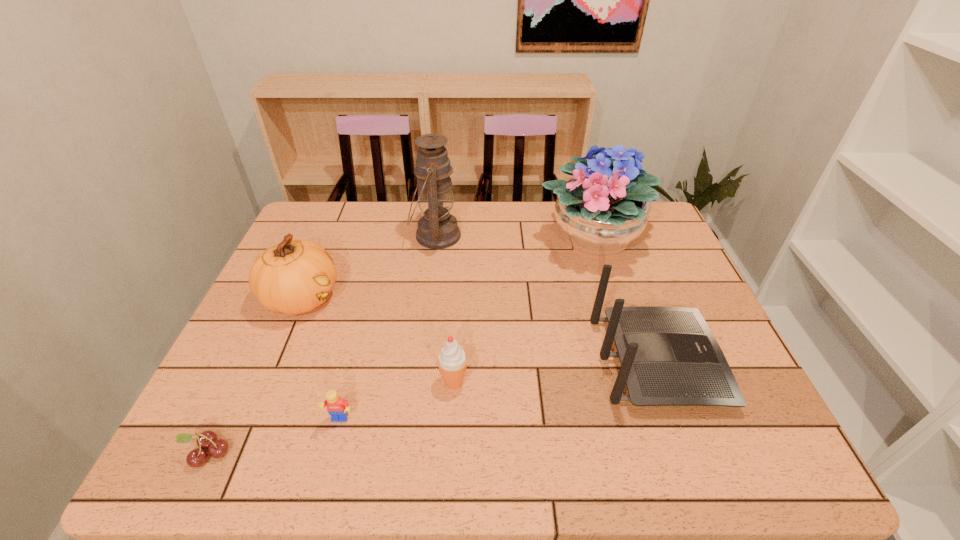
Find the location of a particular element. Image resolution: width=960 pixels, height=540 pixels. oil lamp is located at coordinates (438, 229).

I want to click on bouquet, so [x=599, y=214].

Identify the location of router. (669, 356).

Where is `pumpkin`? This screenshot has height=540, width=960. pumpkin is located at coordinates (295, 276).

The height and width of the screenshot is (540, 960). Identify the location of icecream. (452, 361).

Find the location of a particular element. Lego is located at coordinates (337, 408).

At what (x,y) coordinates should I click in order to perform the action: click on the sixth tallest object. Please return your answer as a coordinate pair (x, y). This screenshot has width=960, height=540. Looking at the image, I should click on (337, 408).

Image resolution: width=960 pixels, height=540 pixels. Identify the location of cherry. (208, 439).

Find the location of a particular element. The height and width of the screenshot is (540, 960). the nearest object is located at coordinates (208, 439).

At what (x,y) coordinates should I click in order to perform the action: click on free space located on the left of the oil lamp. Please return your answer as a coordinate pair (x, y). Looking at the image, I should click on (298, 235).